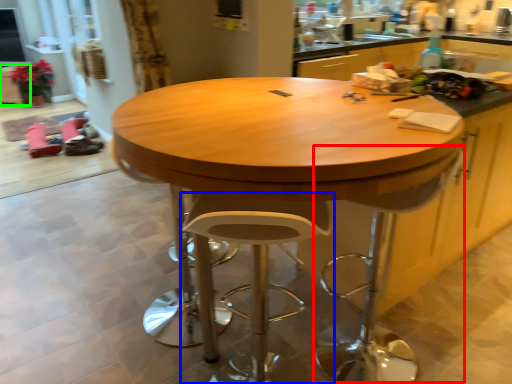
Question: Considering the real-world distances, which object is farthest from swivel chair (highlighted by a red box)? stool (highlighted by a blue box) or cabinetry (highlighted by a green box)?

Choices:
 (A) stool
 (B) cabinetry

Answer: (B)